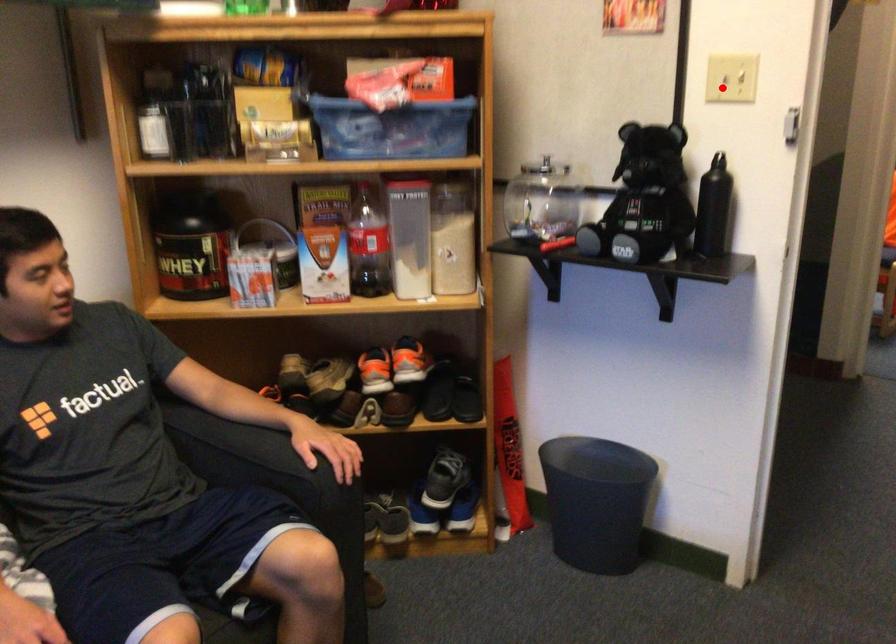
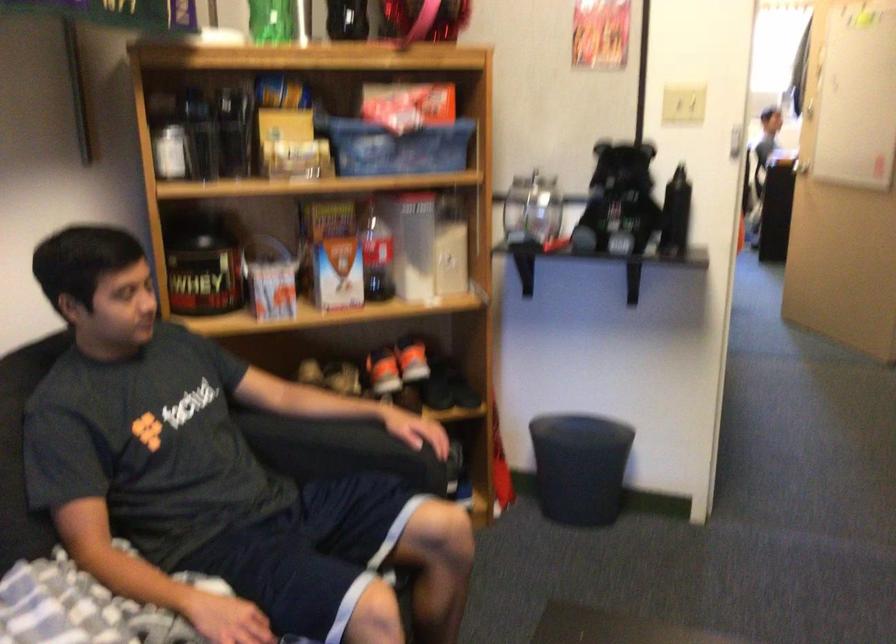
Question: A red point is marked in image1. In image2, is the corresponding 3D point closer to the camera or farther? Reply with the corresponding letter.

Choices:
 (A) The corresponding 3D point is closer.
 (B) The corresponding 3D point is farther.

Answer: (B)